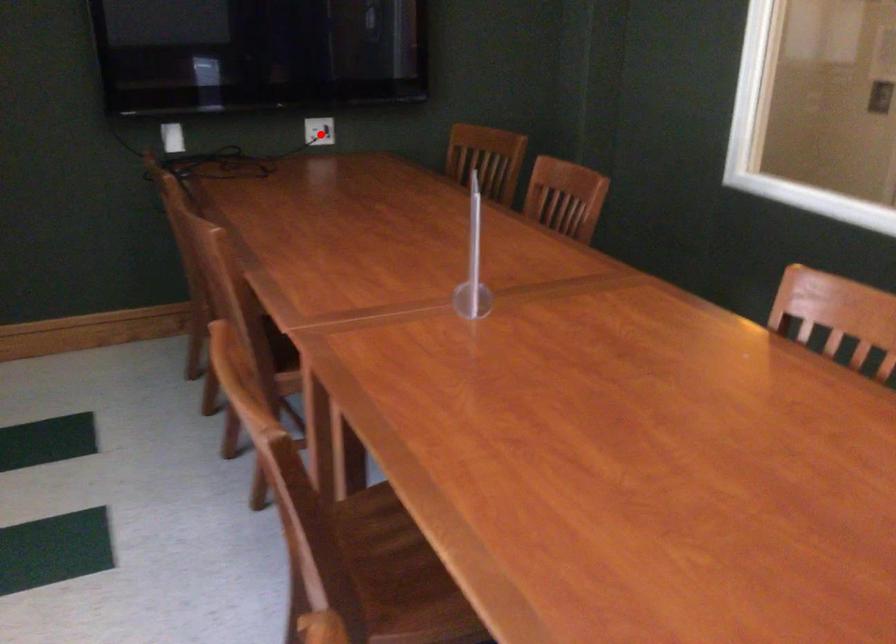
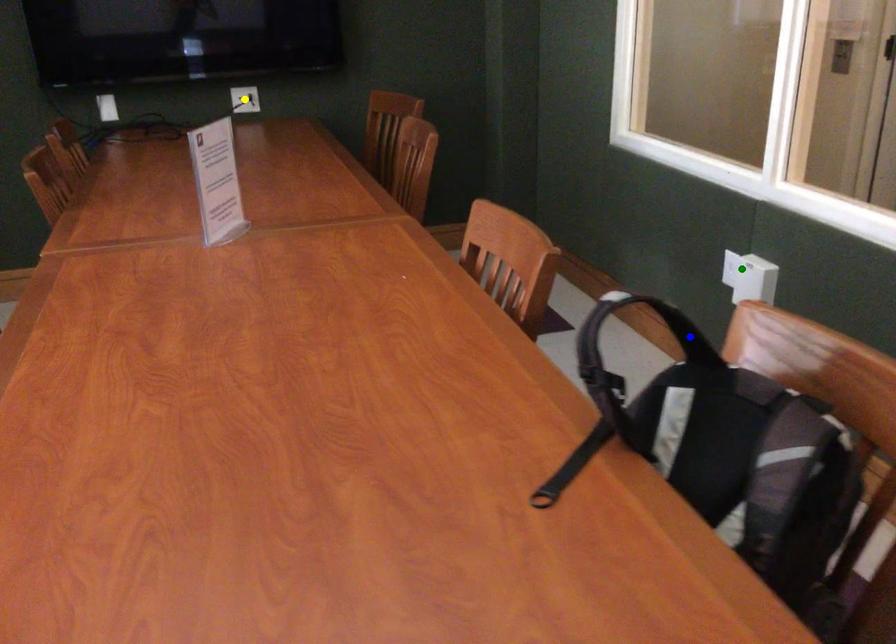
Question: I am providing you with two images of the same scene from different viewpoints. A red point is marked on the first image. You are given multiple points on the second image. Can you choose the point in image 2 that corresponds to the point in image 1?

Choices:
 (A) green point
 (B) blue point
 (C) yellow point

Answer: (C)